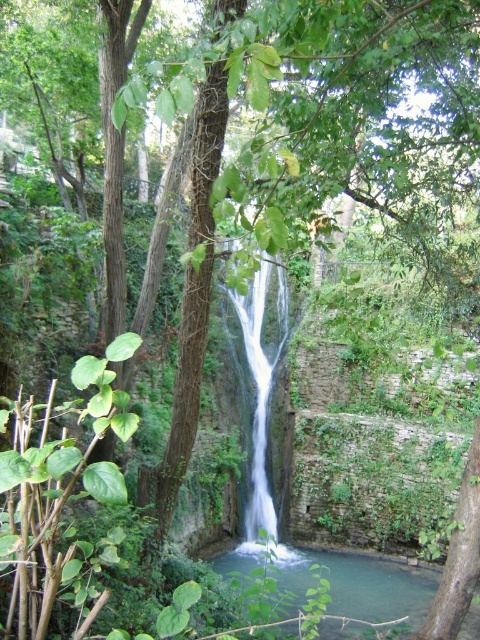
Looking at this image, you are standing at the edge of the clear water at center and want to climb up to the white smooth waterfall at center. Which direction should you move to reach the waterfall?

You should move upward because the white smooth waterfall at center is taller than the clear water at center.

You are a photographer planning to capture the waterfall and the pool below. You want to ensure both the clear water at center and the white smooth waterfall at center are visible in your shot. Which one should you focus on first to ensure proper framing?

The clear water at center is thinner than the white smooth waterfall at center, so you should focus on the white smooth waterfall at center first to ensure it is properly framed before adjusting for the thinner clear water at center.